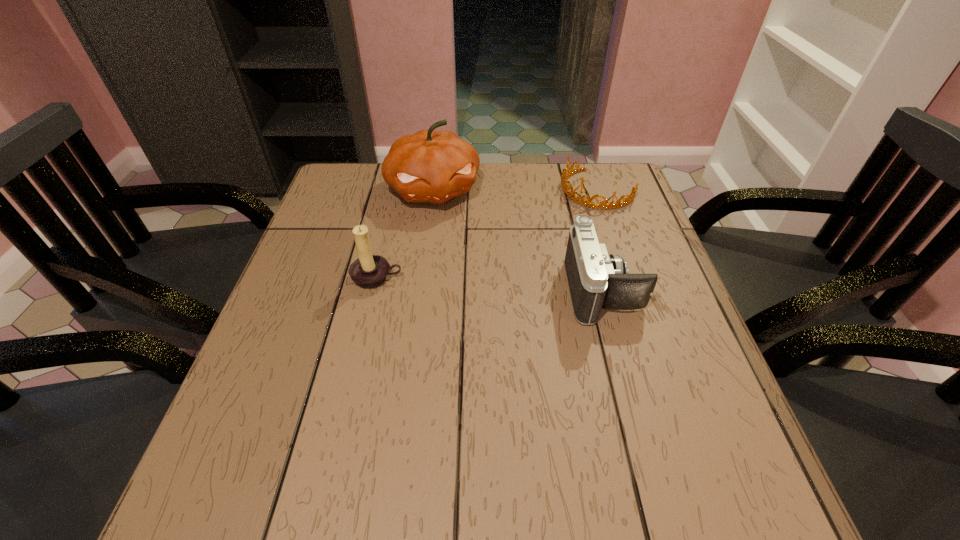
Find the location of a particular element. candle holder is located at coordinates (369, 271).

Identify the location of camera. (596, 279).

The height and width of the screenshot is (540, 960). I want to click on tiara, so click(x=629, y=198).

This screenshot has width=960, height=540. I want to click on the tallest object, so click(429, 166).

Where is `free space located on the wick of the candle holder`? free space located on the wick of the candle holder is located at coordinates (344, 419).

Locate an element on the screen. This screenshot has width=960, height=540. free spot located 0.250m on the front-facing side of the tiara is located at coordinates (524, 250).

Where is `free point located 0.350m on the front-facing side of the tiara`? The height and width of the screenshot is (540, 960). free point located 0.350m on the front-facing side of the tiara is located at coordinates (499, 272).

I want to click on free space located on the front-facing side of the tiara, so click(499, 272).

Where is `blank space located 0.100m on the front face of the tallest object`? blank space located 0.100m on the front face of the tallest object is located at coordinates (451, 240).

Locate an element on the screen. vacant space located on the front face of the tallest object is located at coordinates (459, 263).